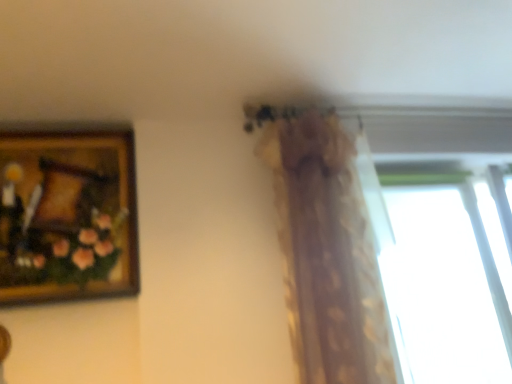
Question: Considering the positions of transparent glass window at upper right and translucent floral-patterned curtain at upper center in the image, is transparent glass window at upper right taller or shorter than translucent floral-patterned curtain at upper center?

Choices:
 (A) short
 (B) tall

Answer: (A)

Question: Is transparent glass window at upper right to the left or to the right of translucent floral-patterned curtain at upper center in the image?

Choices:
 (A) left
 (B) right

Answer: (B)

Question: Which is farther from the translucent floral-patterned curtain at upper center?

Choices:
 (A) wooden framed painting at upper left
 (B) transparent glass window at upper right

Answer: (B)

Question: Considering the real-world distances, which object is closest to the transparent glass window at upper right?

Choices:
 (A) translucent floral-patterned curtain at upper center
 (B) wooden framed painting at upper left

Answer: (A)